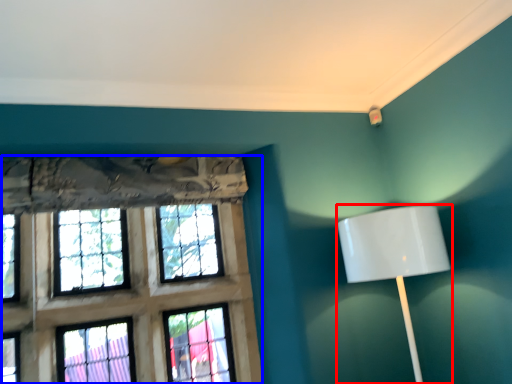
Question: Which object appears farthest to the camera in this image, lamp (highlighted by a red box) or window (highlighted by a blue box)?

Choices:
 (A) lamp
 (B) window

Answer: (B)